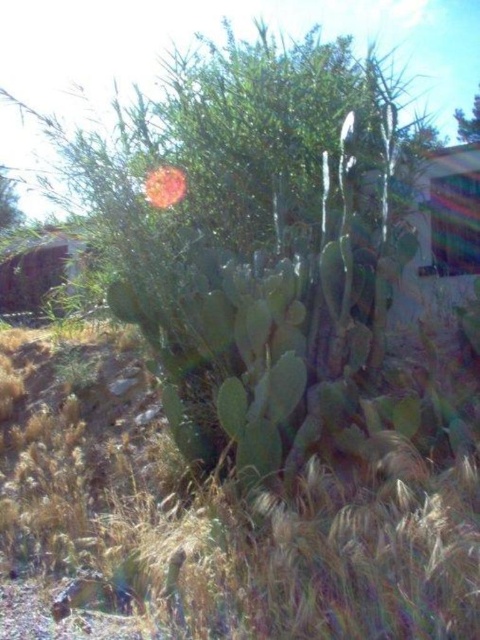
Question: Which point is closer to the camera?

Choices:
 (A) (186, 184)
 (B) (292, 628)

Answer: (B)

Question: Where is green grass at center located in relation to smooth pink flower at center in the image?

Choices:
 (A) right
 (B) left

Answer: (A)

Question: Can you confirm if green grass at center is smaller than smooth pink flower at center?

Choices:
 (A) no
 (B) yes

Answer: (B)

Question: Among these objects, which one is nearest to the camera?

Choices:
 (A) green grass at center
 (B) smooth pink flower at center

Answer: (A)

Question: Is green grass at center below smooth pink flower at center?

Choices:
 (A) yes
 (B) no

Answer: (A)